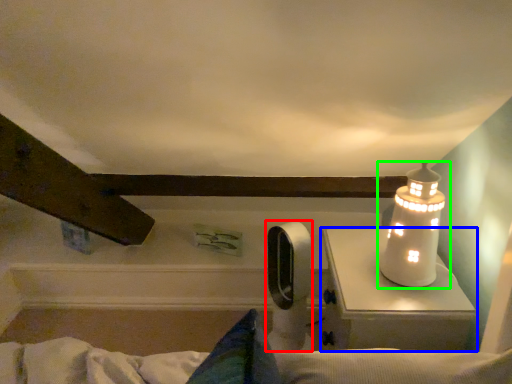
Question: Based on their relative distances, which object is nearer to equipment (highlighted by a red box)? Choose from table (highlighted by a blue box) and lamp (highlighted by a green box).

Choices:
 (A) table
 (B) lamp

Answer: (A)